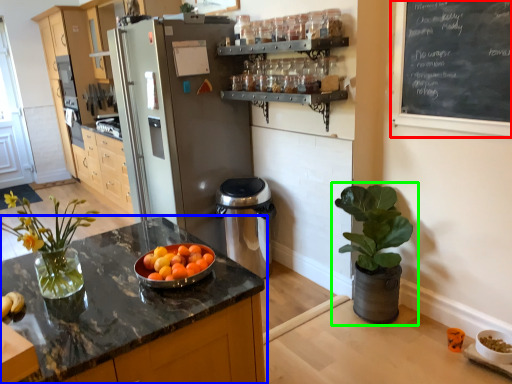
Question: Considering the real-world distances, which object is farthest from bulletin board (highlighted by a red box)? countertop (highlighted by a blue box) or houseplant (highlighted by a green box)?

Choices:
 (A) countertop
 (B) houseplant

Answer: (A)